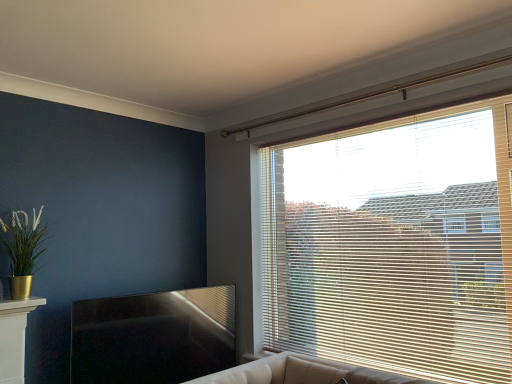
Question: Is wooden blinds at upper right at the back of gold metallic pot at left?

Choices:
 (A) yes
 (B) no

Answer: (B)

Question: Is gold metallic pot at left positioned in front of wooden blinds at upper right?

Choices:
 (A) no
 (B) yes

Answer: (A)

Question: Does gold metallic pot at left appear on the left side of wooden blinds at upper right?

Choices:
 (A) no
 (B) yes

Answer: (B)

Question: Does gold metallic pot at left have a greater width compared to wooden blinds at upper right?

Choices:
 (A) no
 (B) yes

Answer: (B)

Question: From the image's perspective, is gold metallic pot at left below wooden blinds at upper right?

Choices:
 (A) no
 (B) yes

Answer: (B)

Question: Could you tell me if gold metallic pot at left is turned towards wooden blinds at upper right?

Choices:
 (A) no
 (B) yes

Answer: (A)

Question: Is wooden blinds at upper right not close to gold metallic pot at left?

Choices:
 (A) yes
 (B) no

Answer: (A)

Question: Is wooden blinds at upper right positioned before gold metallic pot at left?

Choices:
 (A) yes
 (B) no

Answer: (A)

Question: Could you tell me if wooden blinds at upper right is turned towards gold metallic pot at left?

Choices:
 (A) yes
 (B) no

Answer: (A)

Question: Would you say wooden blinds at upper right is outside gold metallic pot at left?

Choices:
 (A) no
 (B) yes

Answer: (B)

Question: From a real-world perspective, is wooden blinds at upper right physically below gold metallic pot at left?

Choices:
 (A) no
 (B) yes

Answer: (B)

Question: Is wooden blinds at upper right to the left of gold metallic pot at left from the viewer's perspective?

Choices:
 (A) no
 (B) yes

Answer: (A)

Question: Choose the correct answer: Is gold metallic pot at left inside wooden blinds at upper right or outside it?

Choices:
 (A) inside
 (B) outside

Answer: (B)